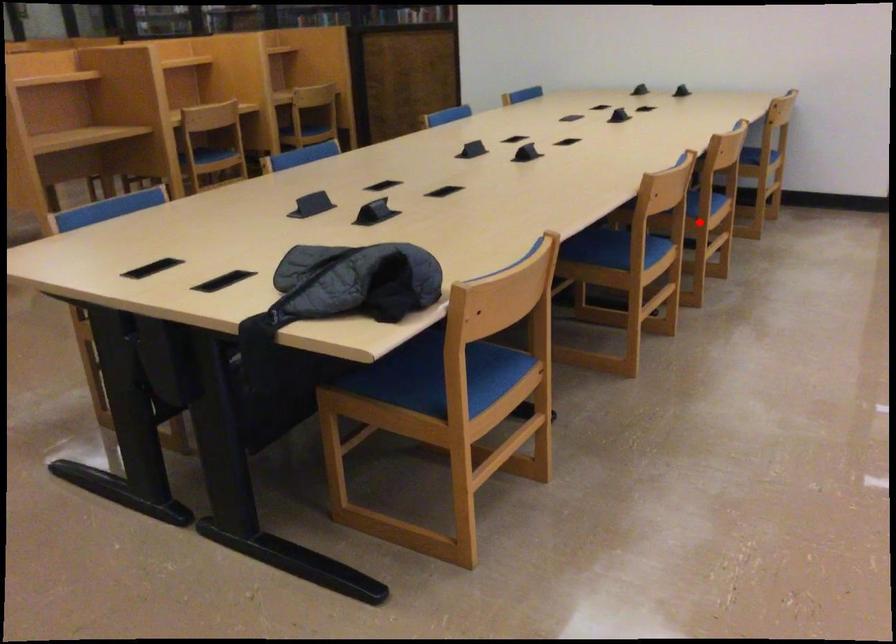
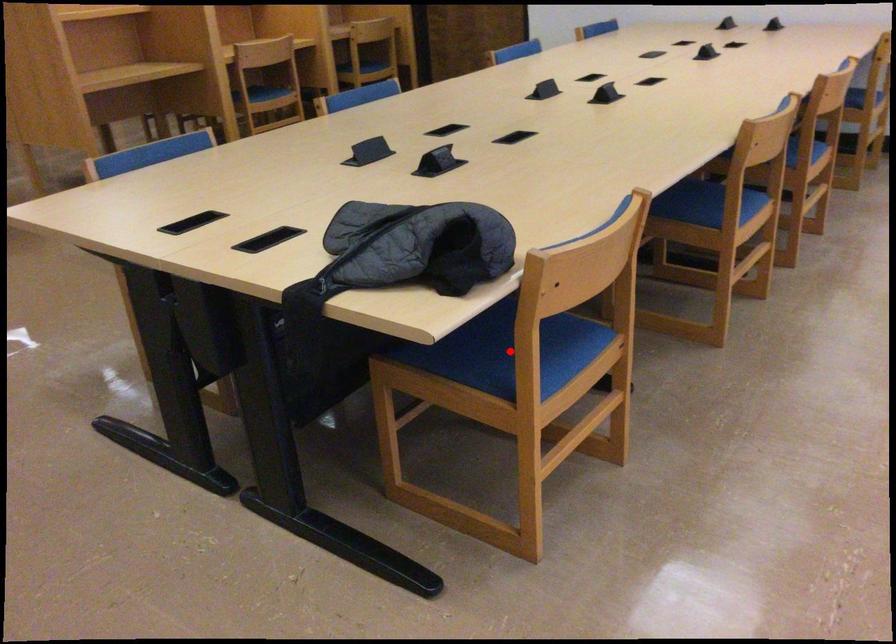
I am providing you with two images of the same scene from different viewpoints. A red point is marked on the first image and another point is marked on the second image. Is the red point in image1 aligned with the point shown in image2?

No